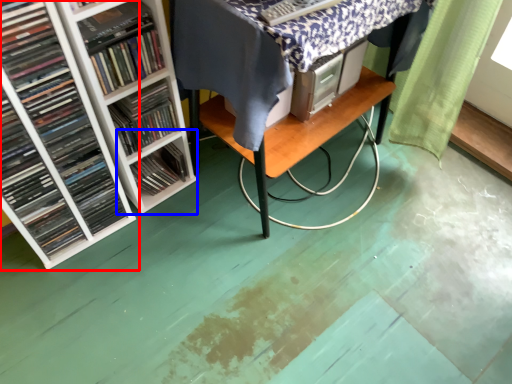
Question: Which object is closer to the camera taking this photo, book (highlighted by a red box) or shelf (highlighted by a blue box)?

Choices:
 (A) book
 (B) shelf

Answer: (A)